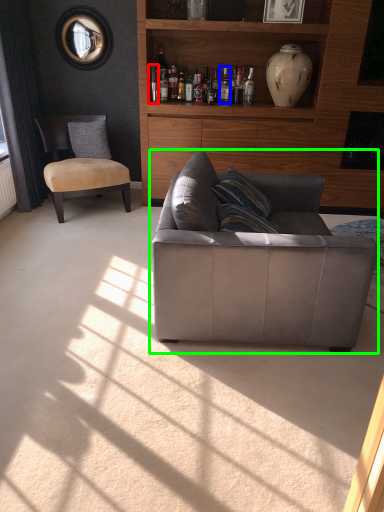
Question: Considering the real-world distances, which object is farthest from bottle (highlighted by a red box)? bottle (highlighted by a blue box) or studio couch (highlighted by a green box)?

Choices:
 (A) bottle
 (B) studio couch

Answer: (B)